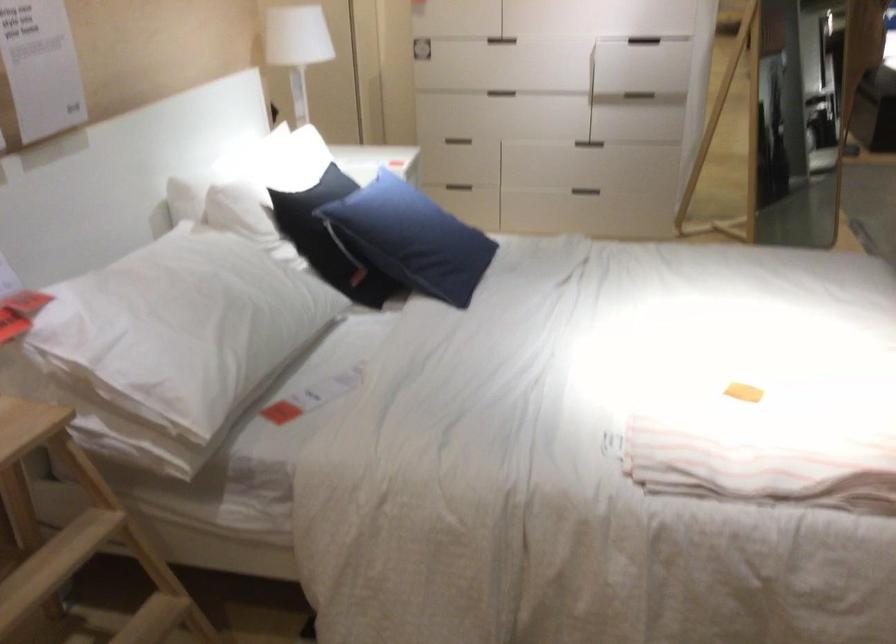
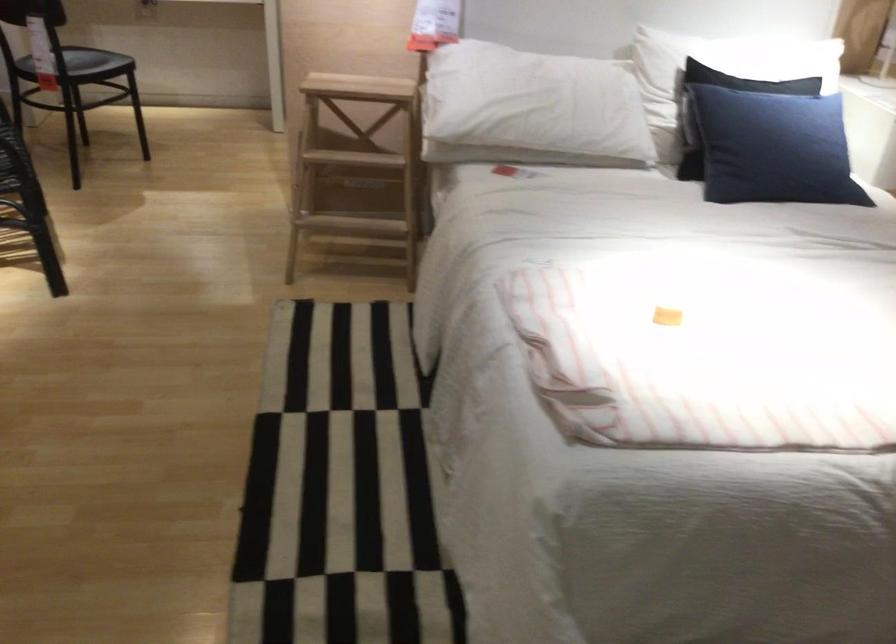
Where in the second image is the point corresponding to point 449,240 from the first image?

(773, 147)